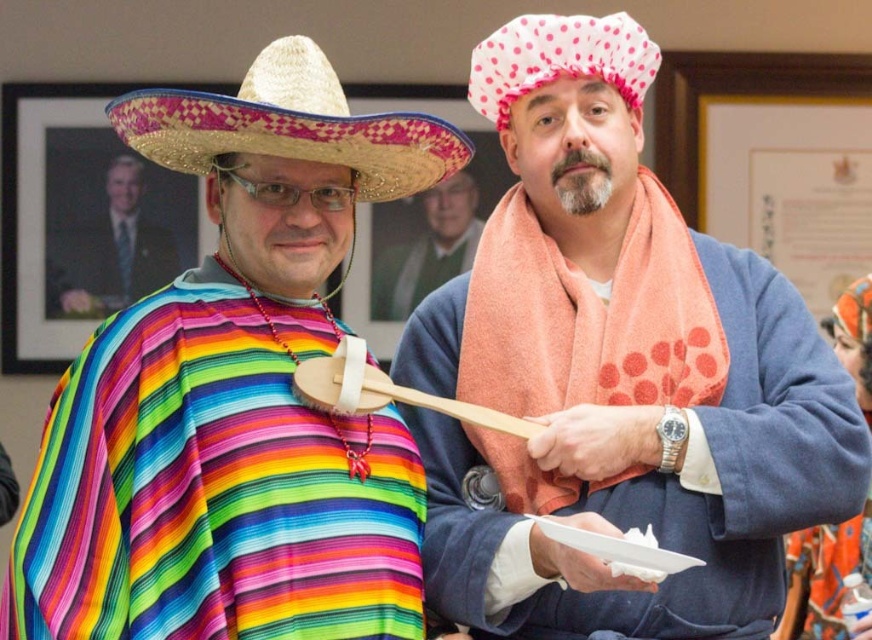
Which is above, pink polka dot fabric at upper center or wooden smooth spoon at center?

pink polka dot fabric at upper center

Can you confirm if pink polka dot fabric at upper center is thinner than wooden smooth spoon at center?

Yes.

Locate an element on the screen. This screenshot has height=640, width=872. pink polka dot fabric at upper center is located at coordinates (559, 58).

Who is taller, rainbow fabric poncho at left or orange towel at right?

Standing taller between the two is orange towel at right.

Who is more forward, (302, 342) or (796, 376)?

Point (302, 342) is more forward.

What do you see at coordinates (208, 492) in the screenshot? I see `rainbow fabric poncho at left` at bounding box center [208, 492].

The width and height of the screenshot is (872, 640). Identify the location of rainbow fabric poncho at left. (208, 492).

Between rainbow fabric poncho at left and polka dot fabric hat at center, which one has more height?

Standing taller between the two is polka dot fabric hat at center.

Which is more to the left, rainbow fabric poncho at left or polka dot fabric hat at center?

Positioned to the left is rainbow fabric poncho at left.

The width and height of the screenshot is (872, 640). What are the coordinates of `rainbow fabric poncho at left` in the screenshot? It's located at (208, 492).